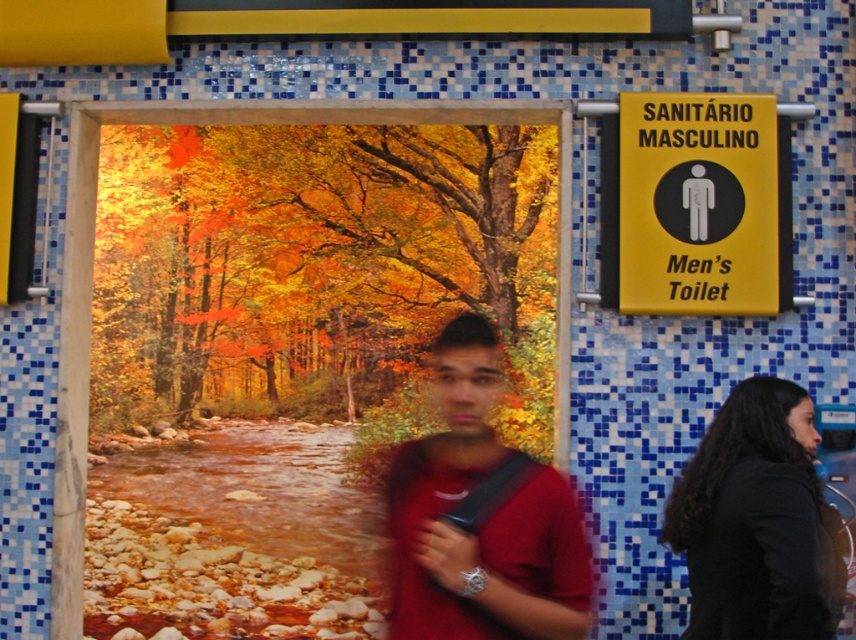
Question: Does matte red shirt at center have a larger size compared to yellow paper sign at upper right?

Choices:
 (A) yes
 (B) no

Answer: (A)

Question: Can you confirm if yellow paper sign at upper right is positioned to the right of black fabric at right?

Choices:
 (A) yes
 (B) no

Answer: (A)

Question: Can you confirm if matte red shirt at center is positioned to the right of black fabric at right?

Choices:
 (A) no
 (B) yes

Answer: (A)

Question: Among these points, which one is nearest to the camera?

Choices:
 (A) (741, 401)
 (B) (473, 509)

Answer: (B)

Question: Which of the following is the closest to the observer?

Choices:
 (A) matte red shirt at center
 (B) yellow paper sign at upper right
 (C) black fabric at right

Answer: (A)

Question: Among these objects, which one is nearest to the camera?

Choices:
 (A) black fabric at right
 (B) yellow paper sign at upper right
 (C) matte red shirt at center

Answer: (C)